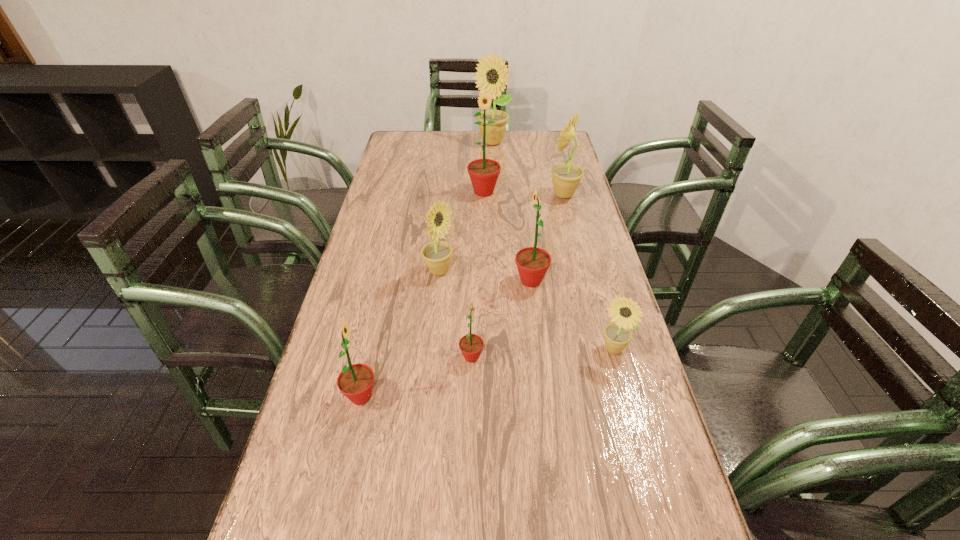
You are a GUI agent. You are given a task and a screenshot of the screen. Output one action in this format:
    pyautogui.click(x=<x>, y=<y>)
    Task: Click on the smallest green sunflower
    The height and width of the screenshot is (540, 960).
    Given the screenshot: What is the action you would take?
    pyautogui.click(x=471, y=345)

At what (x,y) coordinates should I click in order to perform the action: click on the smallest yellow sunflower. Please return your answer as a coordinate pair (x, y). The width and height of the screenshot is (960, 540). Looking at the image, I should click on (626, 313).

This screenshot has width=960, height=540. I want to click on vacant space located 0.080m on the face of the farthest sunflower, so click(492, 160).

I want to click on vacant point located 0.170m on the face of the biggest green sunflower, so click(485, 231).

This screenshot has width=960, height=540. Identify the location of free space located on the face of the second farthest yellow sunflower. (444, 194).

At what (x,y) coordinates should I click in order to perform the action: click on vacant region located on the face of the second farthest yellow sunflower. Please return your answer as a coordinate pair (x, y). The width and height of the screenshot is (960, 540). Looking at the image, I should click on (514, 194).

Where is `vacant area situated on the face of the second farthest yellow sunflower`? The image size is (960, 540). vacant area situated on the face of the second farthest yellow sunflower is located at coordinates (435, 194).

Where is `free space located on the face of the third smallest green sunflower`? free space located on the face of the third smallest green sunflower is located at coordinates (383, 281).

I want to click on free space located on the face of the third smallest green sunflower, so click(492, 281).

The height and width of the screenshot is (540, 960). I want to click on free space located on the face of the third smallest green sunflower, so click(x=404, y=281).